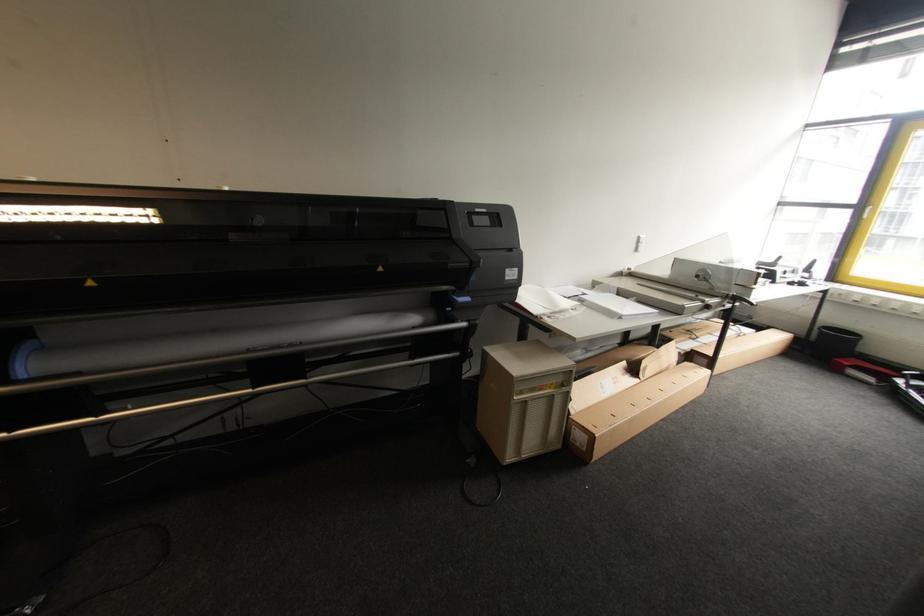
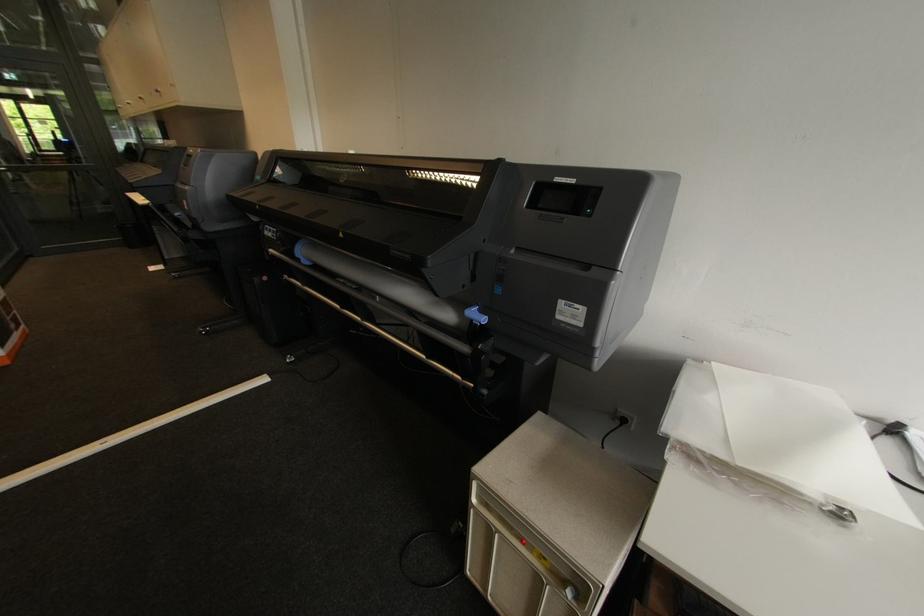
Where in the second image is the point corresponding to (x=511, y=278) from the first image?

(563, 318)